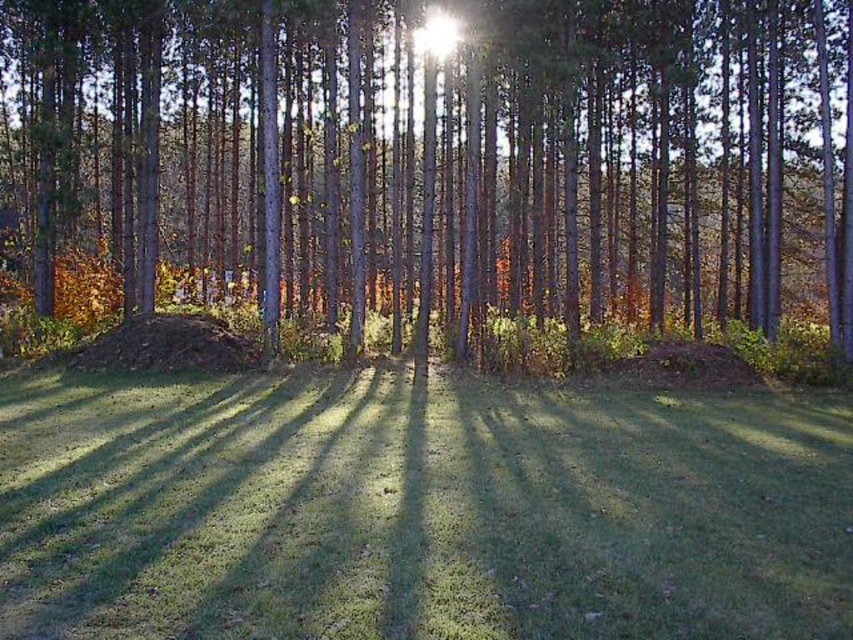
Question: Observing the image, what is the correct spatial positioning of green matte tree at center in reference to brown/dry leaves at center?

Choices:
 (A) below
 (B) above

Answer: (B)

Question: Is green matte tree at center further to the viewer compared to green grass at center?

Choices:
 (A) yes
 (B) no

Answer: (A)

Question: Which is farther from the green matte tree at center?

Choices:
 (A) brown/dry leaves at center
 (B) green grass at center

Answer: (B)

Question: Which point is farther from the camera taking this photo?

Choices:
 (A) (132, 358)
 (B) (584, 621)

Answer: (A)

Question: Which object is positioned closest to the brown/dry leaves at center?

Choices:
 (A) green matte tree at center
 (B) green grass at center

Answer: (B)

Question: Is green matte tree at center below brown/dry leaves at center?

Choices:
 (A) yes
 (B) no

Answer: (B)